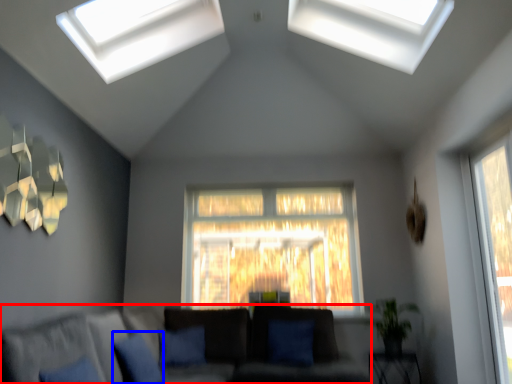
Question: Among these objects, which one is farthest to the camera, studio couch (highlighted by a red box) or pillow (highlighted by a blue box)?

Choices:
 (A) studio couch
 (B) pillow

Answer: (B)